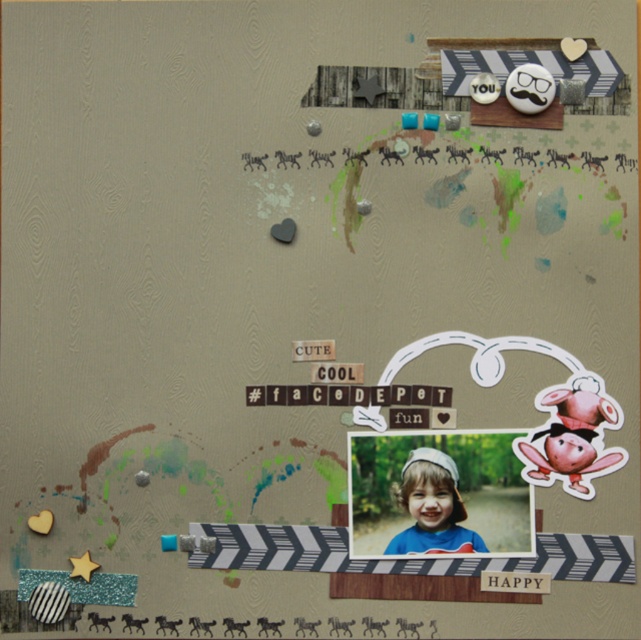
Which is behind, point (408, 506) or point (299, 344)?

The point (299, 344) is more distant.

Find the location of a particular element. matte blue shirt at center is located at coordinates (433, 508).